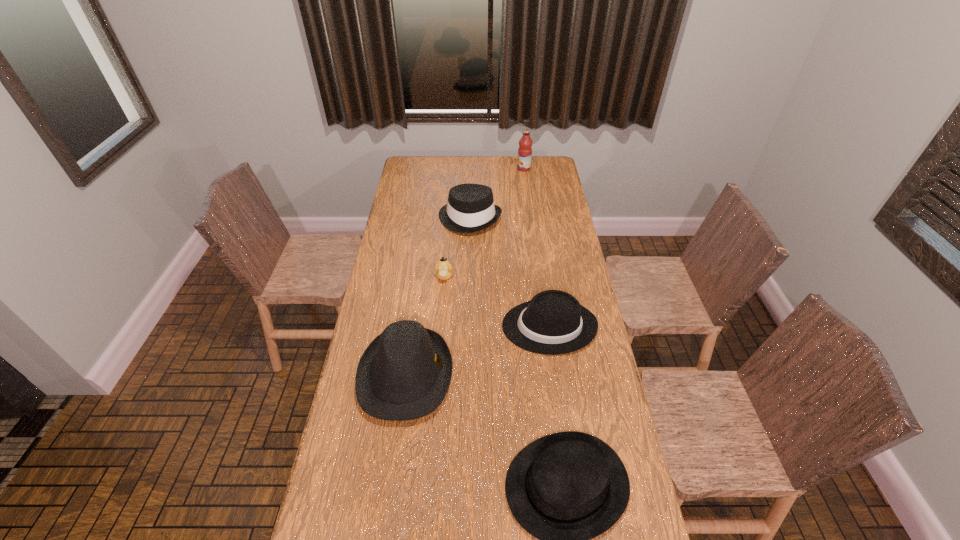
The image size is (960, 540). Find the location of `free space located on the front-facing side of the third shortest object`. free space located on the front-facing side of the third shortest object is located at coordinates (407, 326).

I want to click on vacant space located on the front-facing side of the third shortest object, so click(443, 326).

Where is `free space located on the face of the duckling`? The width and height of the screenshot is (960, 540). free space located on the face of the duckling is located at coordinates (437, 361).

At what (x,y) coordinates should I click in order to perform the action: click on object located at the far edge. Please return your answer as a coordinate pair (x, y). The height and width of the screenshot is (540, 960). Looking at the image, I should click on (525, 143).

Image resolution: width=960 pixels, height=540 pixels. What are the coordinates of `object that is at the left edge` in the screenshot? It's located at (404, 374).

Where is `fruit juice that is at the right edge`? fruit juice that is at the right edge is located at coordinates (525, 143).

This screenshot has width=960, height=540. Identify the location of fedora at the right edge. (553, 322).

You are a GUI agent. You are given a task and a screenshot of the screen. Output one action in this format:
    pyautogui.click(x=<x>, y=<y>)
    Task: Click on the object at the far right corner
    The width and height of the screenshot is (960, 540).
    Given the screenshot: What is the action you would take?
    pyautogui.click(x=525, y=143)

I want to click on free point at the far edge, so click(511, 175).

The height and width of the screenshot is (540, 960). What are the coordinates of `free region at the left edge of the desktop` in the screenshot? It's located at (375, 290).